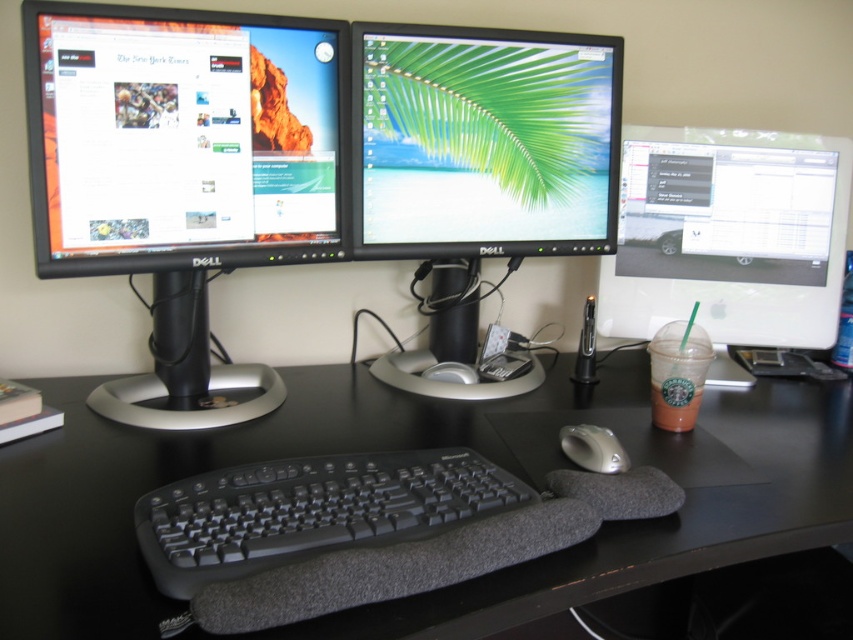
Question: Which object appears closest to the camera in this image?

Choices:
 (A) black glossy monitor at left
 (B) white glossy monitor at upper right
 (C) black rubberized keyboard at center

Answer: (C)

Question: Is black glossy monitor at left smaller than black glossy monitor at center?

Choices:
 (A) yes
 (B) no

Answer: (B)

Question: Among these points, which one is nearest to the camera?

Choices:
 (A) (579, 442)
 (B) (537, 440)
 (C) (669, 182)
 (D) (247, 19)

Answer: (A)

Question: Considering the relative positions of black matte desk at center and black glossy monitor at left in the image provided, where is black matte desk at center located with respect to black glossy monitor at left?

Choices:
 (A) right
 (B) left

Answer: (A)

Question: Which point is farther to the camera?

Choices:
 (A) (822, 344)
 (B) (587, 456)
 (C) (271, 209)

Answer: (A)

Question: Observing the image, what is the correct spatial positioning of black glossy monitor at center in reference to black rubberized keyboard at center?

Choices:
 (A) right
 (B) left

Answer: (A)